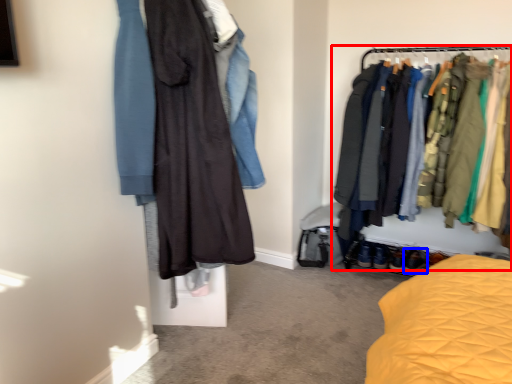
Question: Which point is further to the camera, closet (highlighted by a red box) or footwear (highlighted by a blue box)?

Choices:
 (A) closet
 (B) footwear

Answer: (B)